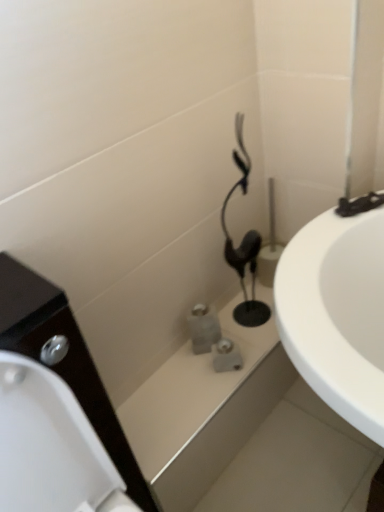
Question: Is point (268, 367) closer or farther from the camera than point (251, 324)?

Choices:
 (A) farther
 (B) closer

Answer: (B)

Question: Is matte gray stone bath at center, the first bath from the back, wider or thinner than black plastic hairdryer at center?

Choices:
 (A) thin
 (B) wide

Answer: (B)

Question: Which object is the closest to the black plastic hairdryer at center?

Choices:
 (A) white glossy bath at center, acting as the 2th bath starting from the back
 (B) matte gray stone bath at center, the 2th bath from the front

Answer: (A)

Question: Which object is the farthest from the black plastic hairdryer at center?

Choices:
 (A) white glossy bath at center, acting as the 2th bath starting from the back
 (B) matte gray stone bath at center, the first bath from the back

Answer: (B)